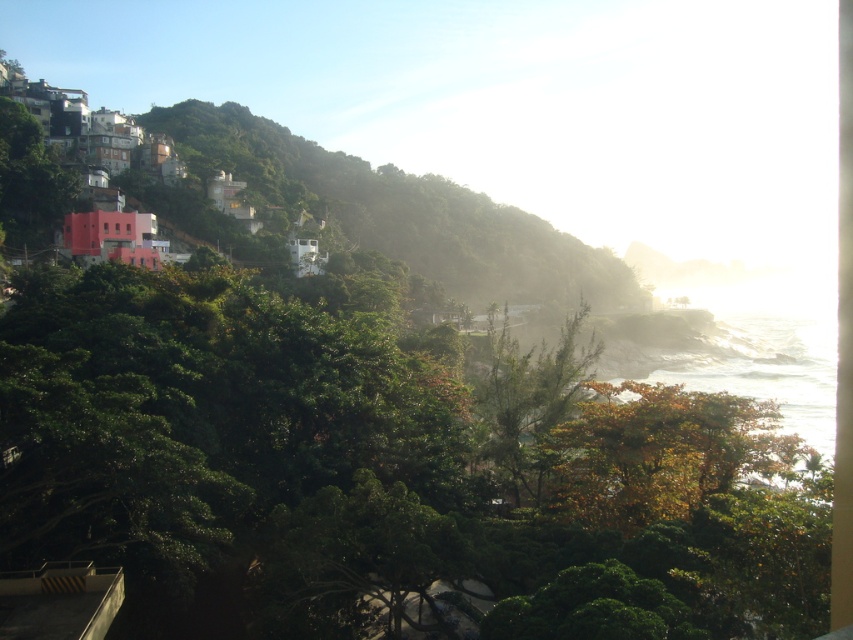
You are a hiker standing at the bottom of the hill looking up. You see the green leafy hillside at upper left and autumn leaves at center. Which of these two is closer to you?

The autumn leaves at center is behind the green leafy hillside at upper left, so the green leafy hillside at upper left is closer to you.

You are standing in a coastal area and see the green leafy hillside at upper left and autumn leaves at center. Which of these two features is positioned more to the left side of the image?

The green leafy hillside at upper left is more to the left than the autumn leaves at center.

You are standing at the base of the hillside in the coastal view and want to reach both the point at coordinates point (181, 106) and point (672, 486). Which point should you head towards first if you want to reach the one closer to you first?

You should head towards point (181, 106) first because it is closer to you than point (672, 486).